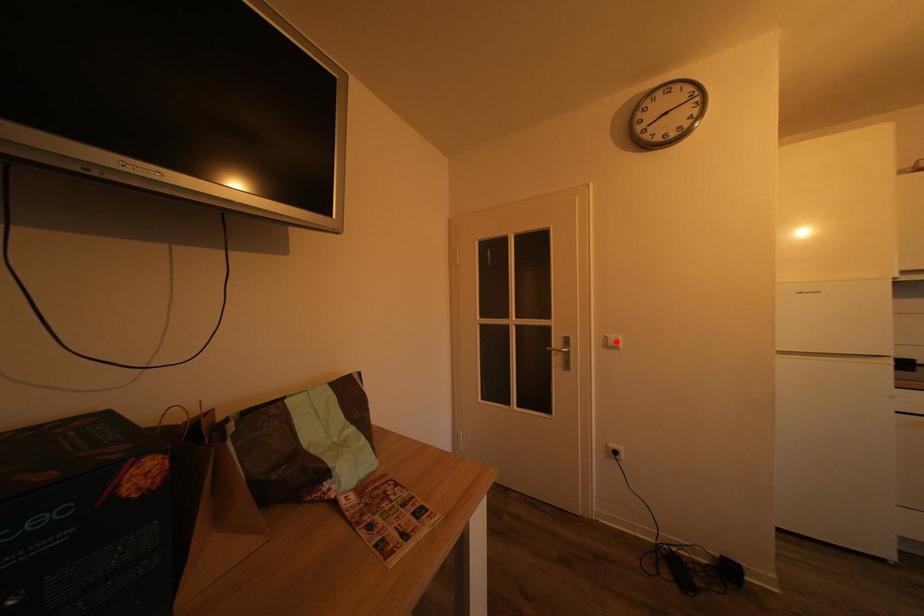
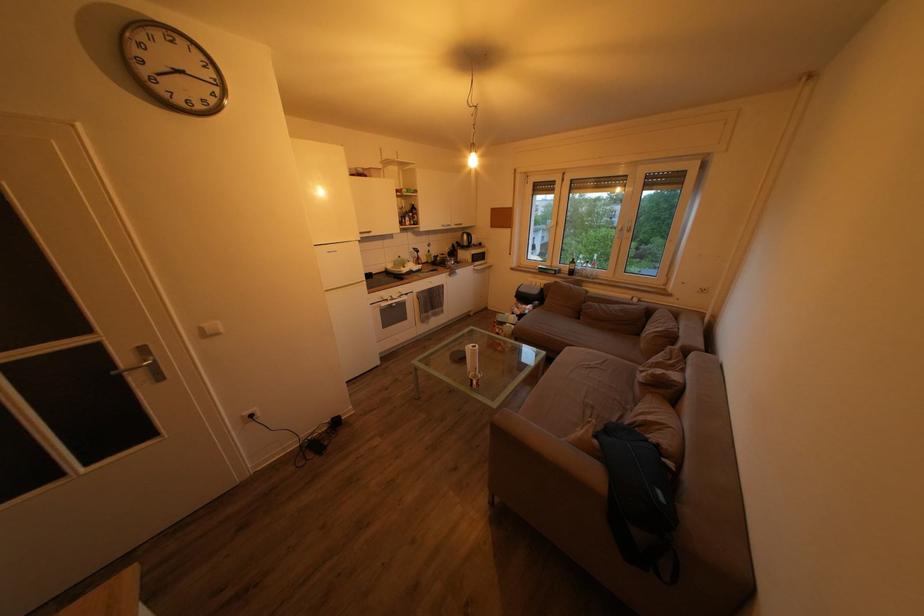
In the second image, find the point that corresponds to the highlighted location in the first image.

(211, 331)